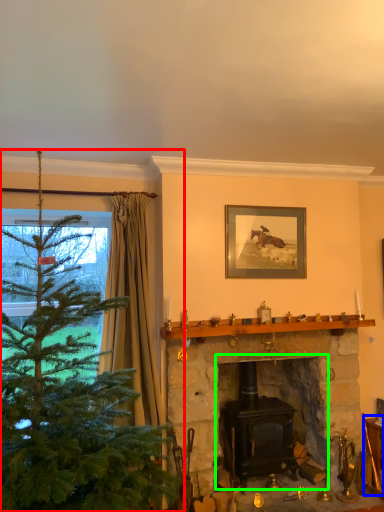
Question: Which object is the closest to the christmas tree (highlighted by a red box)? Choose among these: furniture (highlighted by a blue box) or fireplace (highlighted by a green box).

Choices:
 (A) furniture
 (B) fireplace

Answer: (B)